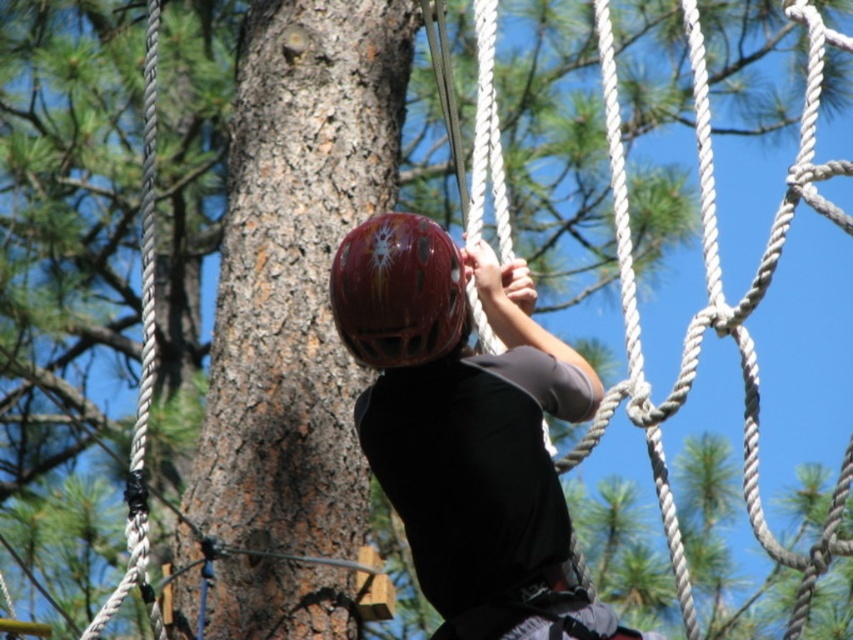
You are an equipment inspector checking the safety gear of the climber. You notice two helmets labeled as the same model but see two different descriptions in the system. The system says one is a shiny red helmet at center and the other is a glossy red helmet at center. Based on the image, which helmet has a greater width?

The shiny red helmet at center has a greater width than the glossy red helmet at center, as stated in the description.

You are a safety inspector checking the equipment of the climber in the image. You notice two red helmets labeled as shiny red helmet at center and glossy red helmet at center. According to the safety guidelines, the helmet with the taller profile must be used for this activity. Which helmet should the climber use?

The shiny red helmet at center is much taller than the glossy red helmet at center, so the climber should use the shiny red helmet at center as it meets the safety guideline requirement for a taller profile.

You are an outdoor safety inspector and you need to ensure that the correct helmet is being used. The shiny red helmet at center is supposed to be the primary safety gear. However, there is another glossy red helmet at center present. Which helmet is larger and should be prioritized for use?

The shiny red helmet at center is bigger than the glossy red helmet at center, so the shiny red helmet at center should be prioritized for use as it is the larger one and meets the safety requirements.